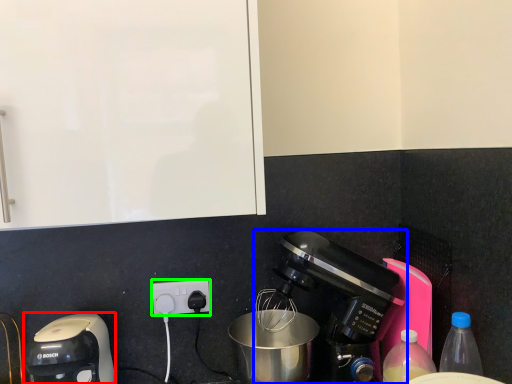
Question: Based on their relative distances, which object is farther from coffee maker (highlighted by a red box)? Choose from coffee maker (highlighted by a blue box) and power plugs and sockets (highlighted by a green box).

Choices:
 (A) coffee maker
 (B) power plugs and sockets

Answer: (A)